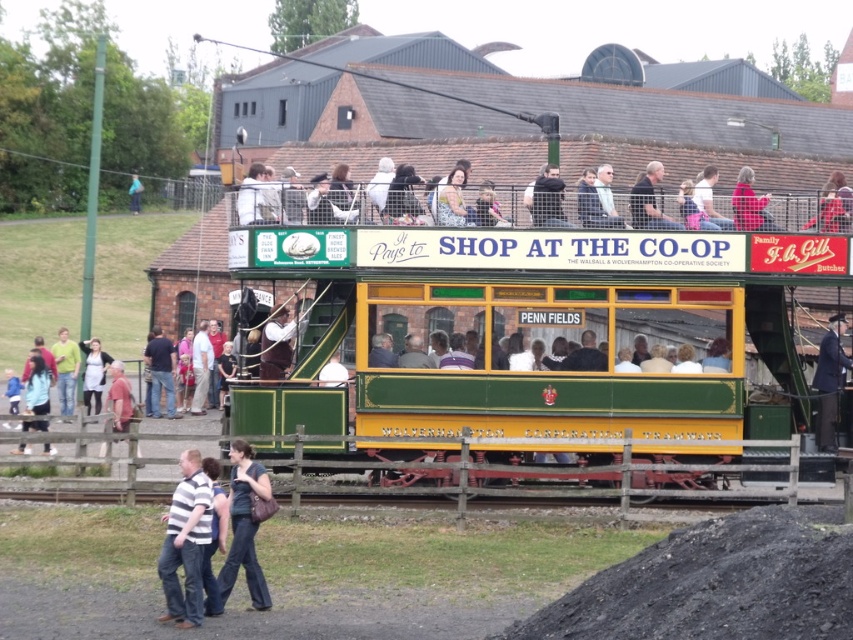
Is point (607, 284) in front of point (224, 572)?

No, it is not.

Describe the element at coordinates (537, 340) in the screenshot. The height and width of the screenshot is (640, 853). I see `green wooden train at center` at that location.

This screenshot has height=640, width=853. What do you see at coordinates (537, 340) in the screenshot?
I see `green wooden train at center` at bounding box center [537, 340].

What are the coordinates of `green wooden train at center` in the screenshot? It's located at (537, 340).